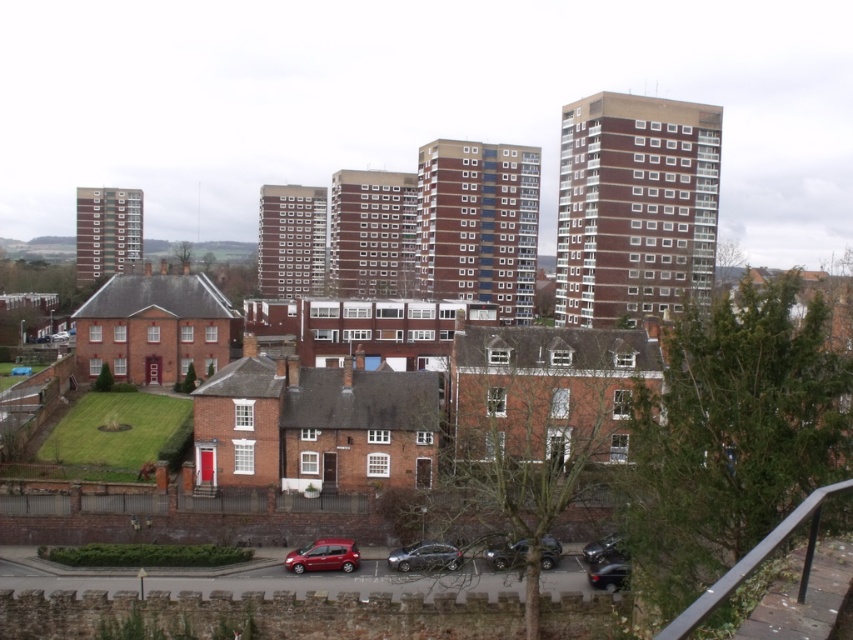
Question: Which object is positioned closest to the shiny black car at lower center?

Choices:
 (A) brown brick tower block at upper right
 (B) brick tower block at left

Answer: (A)

Question: Is brick tower block at left bigger than metallic gray car at lower center?

Choices:
 (A) no
 (B) yes

Answer: (B)

Question: Which point is farther to the camera?

Choices:
 (A) shiny black car at lower center
 (B) brown brick tower block at upper right
 (C) brown brick tower block at center

Answer: (C)

Question: Which point is farther to the camera?

Choices:
 (A) (614, 563)
 (B) (717, 182)

Answer: (B)

Question: Does metallic gray car at lower center have a smaller size compared to shiny metallic car at lower right?

Choices:
 (A) no
 (B) yes

Answer: (A)

Question: Does brown brick tower block at upper right have a lesser width compared to metallic silver sedan at lower center?

Choices:
 (A) yes
 (B) no

Answer: (B)